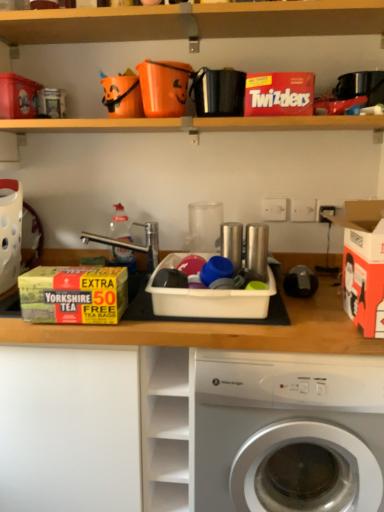
Question: Can you confirm if red cardboard twizzlers at upper center, the 2th storage box positioned from the right, is thinner than black leather wallet at upper center, the first appliance positioned from the left?

Choices:
 (A) no
 (B) yes

Answer: (A)

Question: Could you tell me if red cardboard twizzlers at upper center, acting as the 4th storage box starting from the left, is turned towards black leather wallet at upper center, marked as the 1th appliance in a top-to-bottom arrangement?

Choices:
 (A) no
 (B) yes

Answer: (A)

Question: Is red cardboard twizzlers at upper center, acting as the 4th storage box starting from the left, at the left side of black leather wallet at upper center, arranged as the 2th appliance when ordered from the bottom?

Choices:
 (A) no
 (B) yes

Answer: (A)

Question: Is red cardboard twizzlers at upper center, acting as the 4th storage box starting from the left, positioned in front of black leather wallet at upper center, marked as the 1th appliance in a top-to-bottom arrangement?

Choices:
 (A) yes
 (B) no

Answer: (A)

Question: Does red cardboard twizzlers at upper center, the 2th storage box positioned from the right, have a smaller size compared to black leather wallet at upper center, arranged as the 2th appliance when ordered from the bottom?

Choices:
 (A) yes
 (B) no

Answer: (B)

Question: Considering the positions of black leather wallet at upper center, the first appliance positioned from the left, and white glossy washing machine at lower center in the image, is black leather wallet at upper center, the first appliance positioned from the left, taller or shorter than white glossy washing machine at lower center?

Choices:
 (A) tall
 (B) short

Answer: (B)

Question: From a real-world perspective, is black leather wallet at upper center, arranged as the 2th appliance when ordered from the bottom, physically located above or below white glossy washing machine at lower center?

Choices:
 (A) below
 (B) above

Answer: (B)

Question: Which is correct: black leather wallet at upper center, marked as the 1th appliance in a top-to-bottom arrangement, is inside white glossy washing machine at lower center, or outside of it?

Choices:
 (A) inside
 (B) outside

Answer: (B)

Question: From the image's perspective, is black leather wallet at upper center, marked as the 1th appliance in a top-to-bottom arrangement, located above or below white glossy washing machine at lower center?

Choices:
 (A) above
 (B) below

Answer: (A)

Question: Is matte cardboard box at upper left, the first storage box in the left-to-right sequence, situated inside shiny metallic cup at center, which is the 1th appliance from bottom to top, or outside?

Choices:
 (A) outside
 (B) inside

Answer: (A)

Question: Is matte cardboard box at upper left, the first storage box in the left-to-right sequence, taller or shorter than shiny metallic cup at center, which is the 1th appliance from bottom to top?

Choices:
 (A) tall
 (B) short

Answer: (B)

Question: From a real-world perspective, is matte cardboard box at upper left, marked as the fifth storage box in a right-to-left arrangement, positioned above or below shiny metallic cup at center, arranged as the first appliance when viewed from the right?

Choices:
 (A) above
 (B) below

Answer: (A)

Question: From the image's perspective, is matte cardboard box at upper left, marked as the fifth storage box in a right-to-left arrangement, above or below shiny metallic cup at center, arranged as the first appliance when viewed from the right?

Choices:
 (A) below
 (B) above

Answer: (B)

Question: Is matte cardboard box at upper left, the first storage box in the left-to-right sequence, situated inside yellow cardboard box at left, the second storage box when ordered from left to right, or outside?

Choices:
 (A) outside
 (B) inside

Answer: (A)

Question: Does point (19, 91) appear closer or farther from the camera than point (97, 296)?

Choices:
 (A) closer
 (B) farther

Answer: (B)